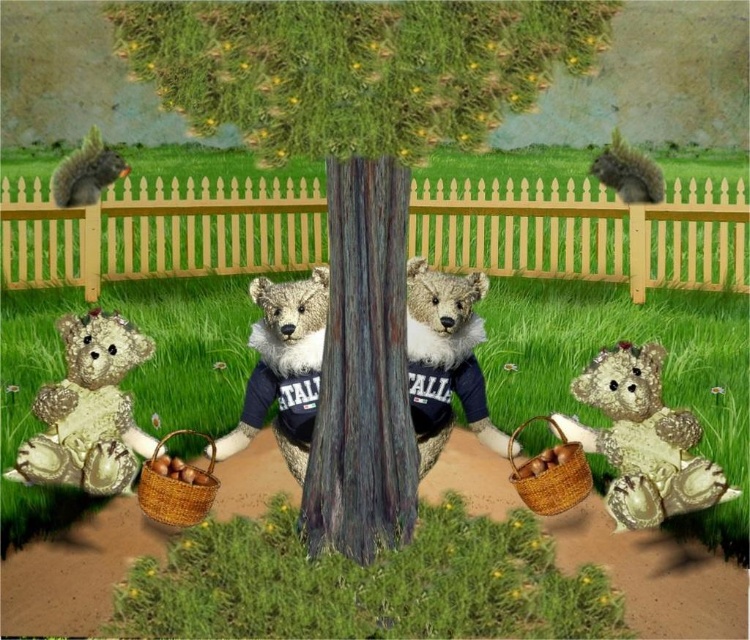
Does fluffy beige teddy bear at lower left appear under brown woven basket at lower left?

Actually, fluffy beige teddy bear at lower left is above brown woven basket at lower left.

Is point (39, 468) farther from viewer compared to point (212, 497)?

Yes, it is.

Find the location of a particular element. This screenshot has width=750, height=640. fluffy beige teddy bear at lower left is located at coordinates (88, 410).

Measure the distance between wooden tree trunk at center and gray furry squirrel at upper left.

wooden tree trunk at center is 8.55 meters from gray furry squirrel at upper left.

Is the position of wooden tree trunk at center less distant than that of gray furry squirrel at upper left?

That is True.

Between point (567, 16) and point (106, 160), which one is positioned behind?

Point (106, 160)

Find the location of `wooden tree trunk at center`. wooden tree trunk at center is located at coordinates (357, 173).

Is fluffy beige teddy bear at lower right behind brown woven basket at lower right?

No.

The width and height of the screenshot is (750, 640). What are the coordinates of `fluffy beige teddy bear at lower right` in the screenshot? It's located at (642, 440).

You are a GUI agent. You are given a task and a screenshot of the screen. Output one action in this format:
    pyautogui.click(x=<x>, y=<y>)
    Task: Click on the fluffy beige teddy bear at lower right
    The width and height of the screenshot is (750, 640).
    Given the screenshot: What is the action you would take?
    pyautogui.click(x=642, y=440)